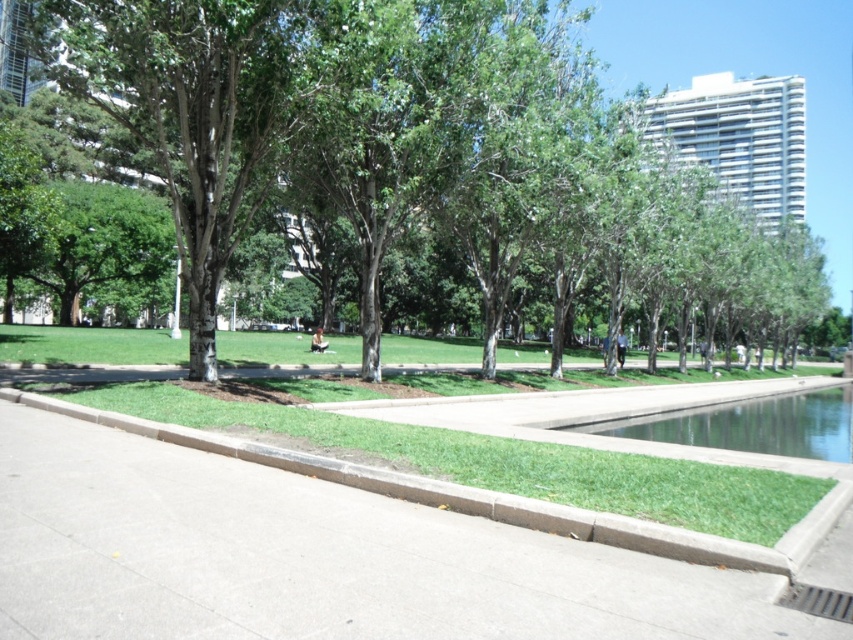
Question: Is green leafy tree at center smaller than concrete at center?

Choices:
 (A) yes
 (B) no

Answer: (B)

Question: Can you confirm if concrete at center is positioned above clear glass water at center?

Choices:
 (A) yes
 (B) no

Answer: (A)

Question: Which object is farther from the camera taking this photo?

Choices:
 (A) concrete at center
 (B) clear glass water at center

Answer: (B)

Question: Is green leafy tree at center behind clear glass water at center?

Choices:
 (A) yes
 (B) no

Answer: (B)

Question: Which point is farther to the camera?

Choices:
 (A) green leafy tree at center
 (B) clear glass water at center
 (C) concrete at center

Answer: (B)

Question: Which of the following is the closest to the observer?

Choices:
 (A) clear glass water at center
 (B) green leafy tree at center

Answer: (B)